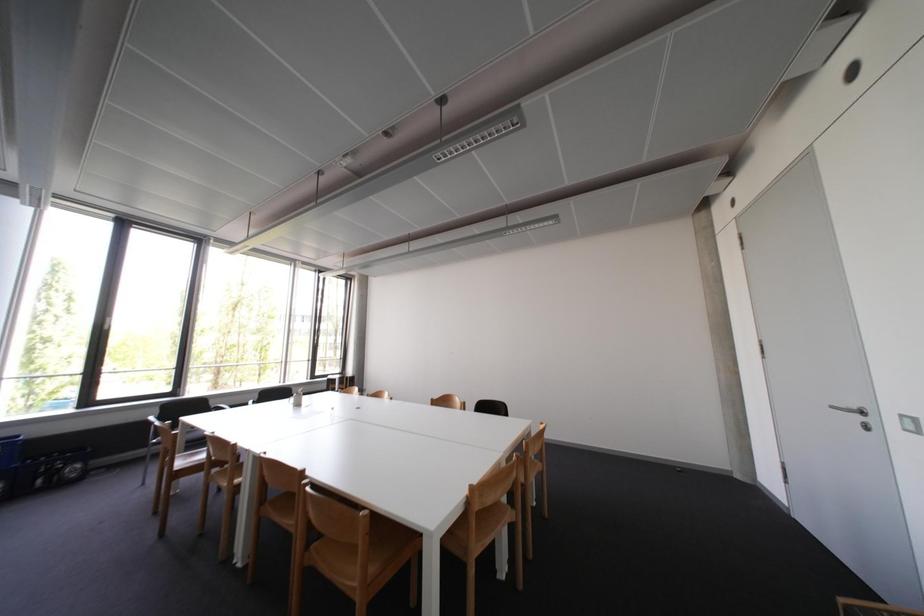
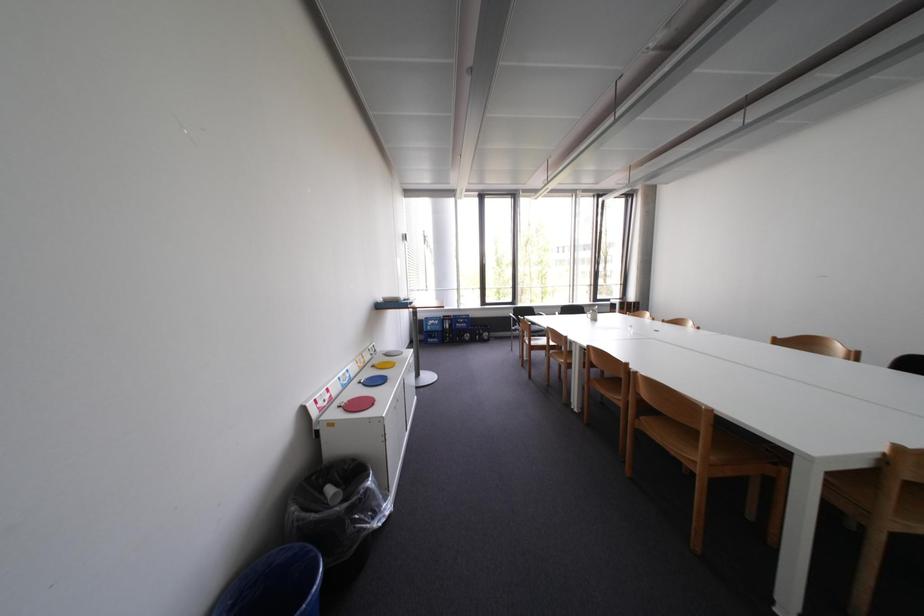
Question: The camera is either moving clockwise (left) or counter-clockwise (right) around the object. The first image is from the beginning of the video and the second image is from the end. Is the camera moving left or right when shooting the video?

Choices:
 (A) Left
 (B) Right

Answer: (B)